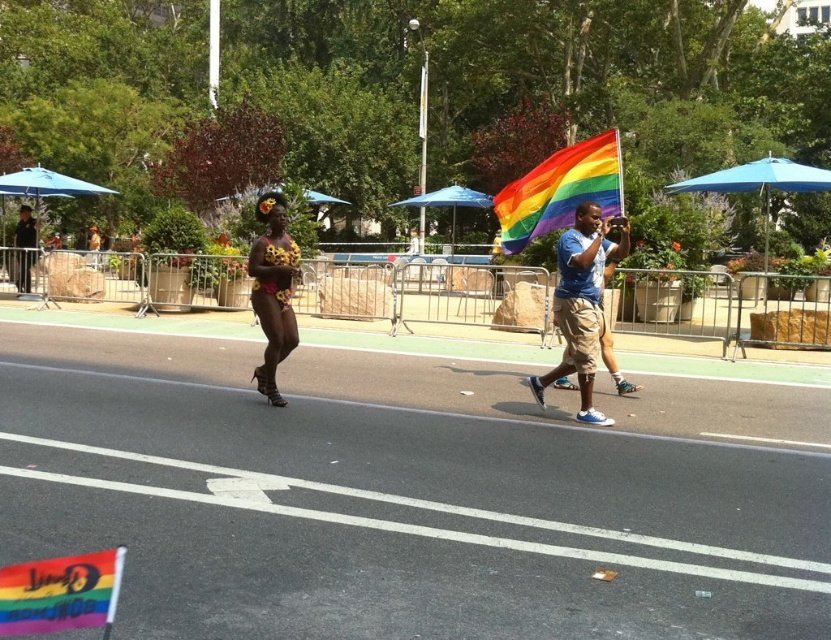
Question: Which object is the farthest from the rainbow fabric umbrella at upper center?

Choices:
 (A) floral-patterned fabric at center
 (B) blue cotton shirt at center
 (C) leopard print dress at center

Answer: (A)

Question: Which object appears closest to the camera in this image?

Choices:
 (A) floral-patterned fabric at center
 (B) blue fabric umbrella at center
 (C) blue cotton shirt at center

Answer: (C)

Question: Does floral-patterned fabric at center lie in front of blue fabric umbrella at center?

Choices:
 (A) yes
 (B) no

Answer: (A)

Question: Which object is farther from the camera taking this photo?

Choices:
 (A) floral-patterned fabric at center
 (B) leopard print dress at center

Answer: (B)

Question: Does blue cotton shirt at center have a greater width compared to floral-patterned fabric at center?

Choices:
 (A) no
 (B) yes

Answer: (B)

Question: Is blue fabric umbrella at upper right to the right of rainbow fabric umbrella at upper center from the viewer's perspective?

Choices:
 (A) no
 (B) yes

Answer: (B)